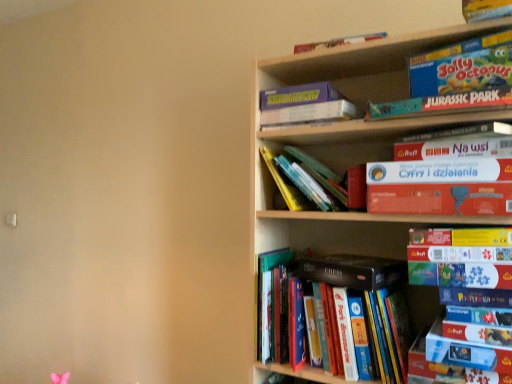
Question: Should I look upward or downward to see wooden bookshelf at upper right?

Choices:
 (A) down
 (B) up

Answer: (A)

Question: Does blue cardboard puzzle at upper right, the ninth book in the top-to-bottom sequence, turn towards blue cardboard puzzle at lower right, arranged as the 10th book when viewed from the top?

Choices:
 (A) yes
 (B) no

Answer: (B)

Question: Does blue cardboard puzzle at upper right, the 4th book in the bottom-to-top sequence, have a smaller size compared to blue cardboard puzzle at lower right, arranged as the 10th book when viewed from the top?

Choices:
 (A) no
 (B) yes

Answer: (A)

Question: Is blue cardboard puzzle at upper right, the 4th book in the bottom-to-top sequence, facing away from blue cardboard puzzle at lower right, arranged as the 10th book when viewed from the top?

Choices:
 (A) no
 (B) yes

Answer: (A)

Question: Is the depth of blue cardboard puzzle at upper right, the ninth book in the top-to-bottom sequence, less than that of blue cardboard puzzle at lower right, arranged as the 10th book when viewed from the top?

Choices:
 (A) no
 (B) yes

Answer: (A)

Question: Is blue cardboard puzzle at upper right, the ninth book in the top-to-bottom sequence, next to blue cardboard puzzle at lower right, arranged as the 10th book when viewed from the top, and touching it?

Choices:
 (A) no
 (B) yes

Answer: (B)

Question: Is blue cardboard puzzle at upper right, the 4th book in the bottom-to-top sequence, outside of blue cardboard puzzle at lower right, placed as the third book when sorted from bottom to top?

Choices:
 (A) yes
 (B) no

Answer: (A)

Question: Can you confirm if purple cardboard game at upper center, which appears as the 10th book when ordered from the bottom, is thinner than blue cardboard puzzle at upper right, the ninth book in the top-to-bottom sequence?

Choices:
 (A) yes
 (B) no

Answer: (A)

Question: Is purple cardboard game at upper center, which appears as the 10th book when ordered from the bottom, further to camera compared to blue cardboard puzzle at upper right, the 4th book in the bottom-to-top sequence?

Choices:
 (A) yes
 (B) no

Answer: (A)

Question: Considering the relative sizes of purple cardboard game at upper center, which appears as the 10th book when ordered from the bottom, and blue cardboard puzzle at upper right, the ninth book in the top-to-bottom sequence, in the image provided, is purple cardboard game at upper center, which appears as the 10th book when ordered from the bottom, wider than blue cardboard puzzle at upper right, the ninth book in the top-to-bottom sequence,?

Choices:
 (A) no
 (B) yes

Answer: (A)

Question: Is there a large distance between purple cardboard game at upper center, which appears as the 10th book when ordered from the bottom, and blue cardboard puzzle at upper right, the 4th book in the bottom-to-top sequence?

Choices:
 (A) no
 (B) yes

Answer: (A)

Question: Considering the relative positions of purple cardboard game at upper center, the third book in the top-to-bottom sequence, and blue cardboard puzzle at upper right, the ninth book in the top-to-bottom sequence, in the image provided, is purple cardboard game at upper center, the third book in the top-to-bottom sequence, to the left of blue cardboard puzzle at upper right, the ninth book in the top-to-bottom sequence, from the viewer's perspective?

Choices:
 (A) no
 (B) yes

Answer: (B)

Question: Considering the relative sizes of purple cardboard game at upper center, which appears as the 10th book when ordered from the bottom, and blue cardboard puzzle at upper right, the ninth book in the top-to-bottom sequence, in the image provided, is purple cardboard game at upper center, which appears as the 10th book when ordered from the bottom, smaller than blue cardboard puzzle at upper right, the ninth book in the top-to-bottom sequence,?

Choices:
 (A) yes
 (B) no

Answer: (A)

Question: Is matte yellow puzzle box at right, positioned as the 5th book in bottom-to-top order, facing towards purple cardboard game at upper center, which appears as the 10th book when ordered from the bottom?

Choices:
 (A) no
 (B) yes

Answer: (A)